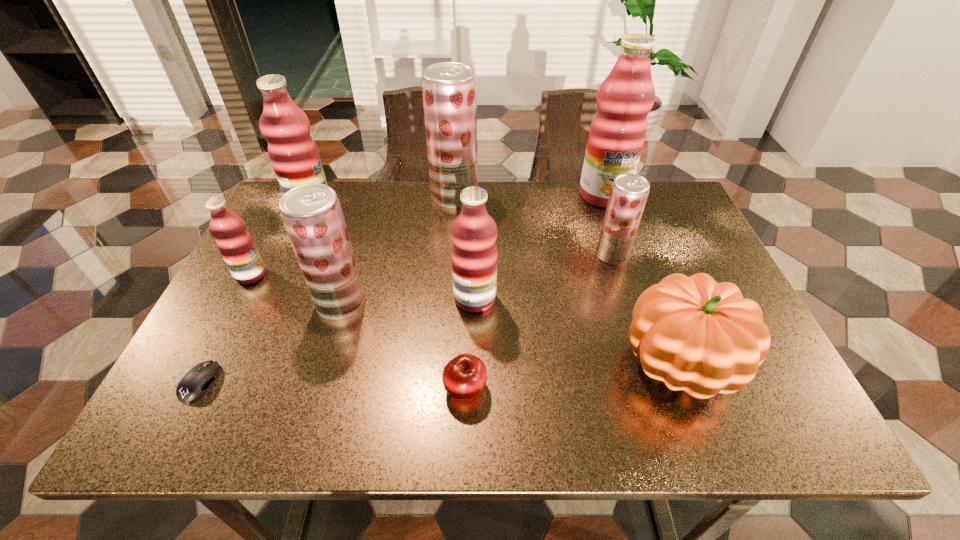
Locate an element on the screen. The height and width of the screenshot is (540, 960). the smallest strawberry fruit juice is located at coordinates (629, 192).

Identify the location of pumpkin. The width and height of the screenshot is (960, 540). (696, 335).

Where is `apple`? apple is located at coordinates (464, 377).

Locate an element on the screen. The image size is (960, 540). pink apple is located at coordinates (464, 377).

This screenshot has width=960, height=540. In order to click on the shortest object in this screenshot , I will do `click(195, 382)`.

Locate an element on the screen. The width and height of the screenshot is (960, 540). computer equipment is located at coordinates tap(195, 382).

Locate an element on the screen. This screenshot has height=540, width=960. free space located 0.290m on the label of the biggest pink fruit juice is located at coordinates (632, 279).

Identify the location of blank space located 0.400m on the front of the second strawberry fruit juice from right to left. (446, 313).

What are the coordinates of `free point located on the label of the second biggest pink fruit juice` in the screenshot? It's located at (379, 206).

You are a GUI agent. You are given a task and a screenshot of the screen. Output one action in this format:
    pyautogui.click(x=<x>, y=<y>)
    Task: Click on the vacant position located 0.400m on the back of the fifth fruit juice from right to left
    The image size is (960, 540).
    Given the screenshot: What is the action you would take?
    pyautogui.click(x=374, y=193)